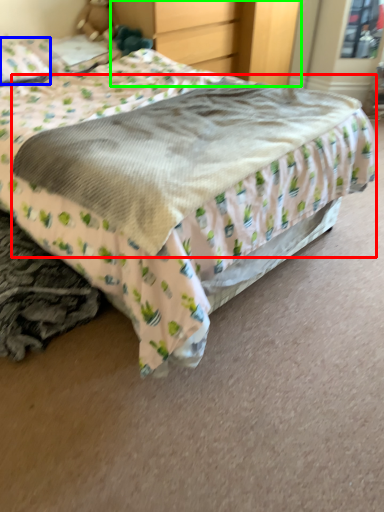
Question: Which is nearer to the mattress (highlighted by a red box)? pillow (highlighted by a blue box) or dresser (highlighted by a green box).

Choices:
 (A) pillow
 (B) dresser

Answer: (A)